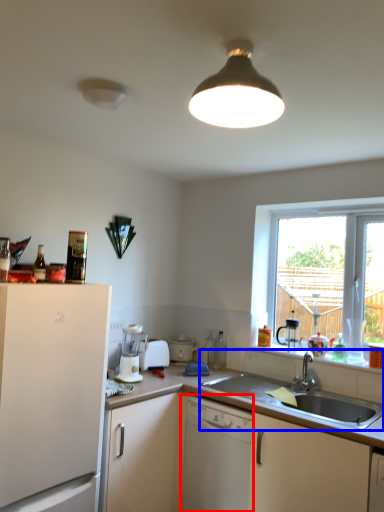
Question: Among these objects, which one is farthest to the camera, dishwasher (highlighted by a red box) or sink (highlighted by a blue box)?

Choices:
 (A) dishwasher
 (B) sink

Answer: (A)